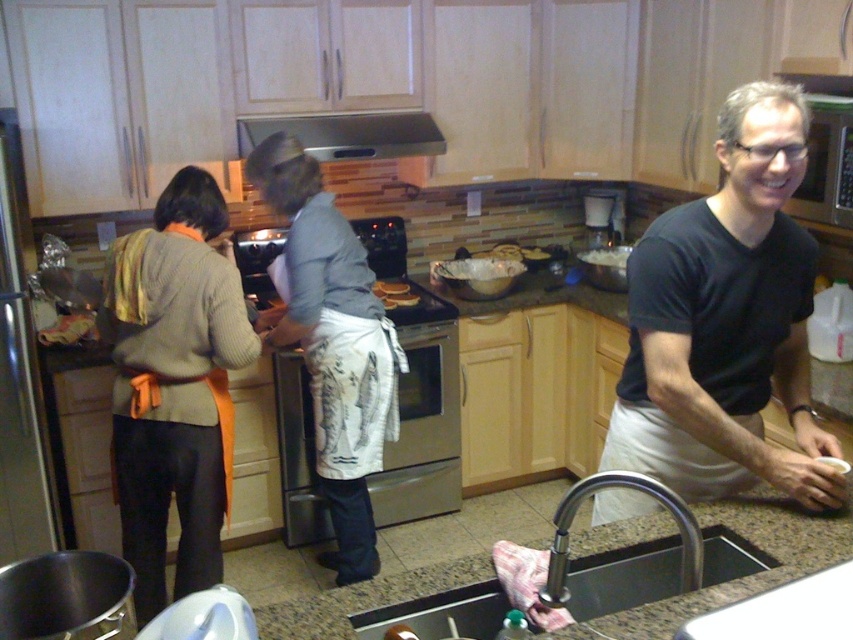
You are a chef who wants to wash your hands before handling the matte white bread at center. Which direction should you move to reach the brushed metal faucet at sink bottom?

The brushed metal faucet at sink bottom is on the right side of the matte white bread at center, so you should move to your right to reach it.

In the kitchen scene, there is an orange apron at left and a metallic stainless steel sink at lower center. From the perspective of someone standing in the kitchen, which object is positioned to the left?

The orange apron at left is positioned to the left of the metallic stainless steel sink at lower center.